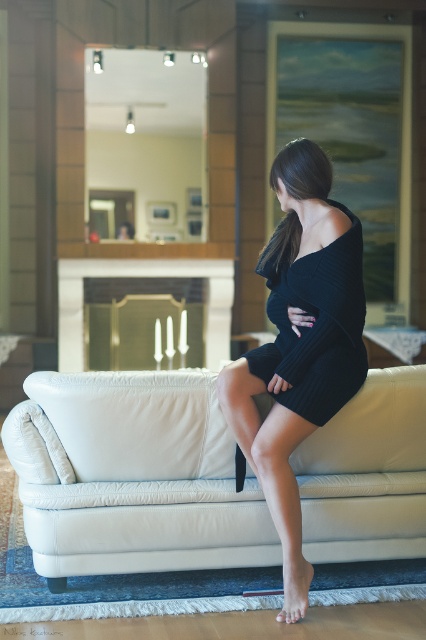
Question: Is white leather couch at center above black knitted dress at center?

Choices:
 (A) yes
 (B) no

Answer: (B)

Question: Which is nearer to the black knitted dress at center?

Choices:
 (A) black ribbed dress at center
 (B) white leather couch at center

Answer: (A)

Question: Which point is farther to the camera?

Choices:
 (A) (317, 349)
 (B) (83, 572)
 (C) (345, 241)

Answer: (B)

Question: Does black knitted dress at center have a greater width compared to black ribbed dress at center?

Choices:
 (A) yes
 (B) no

Answer: (A)

Question: Among these points, which one is farthest from the camera?

Choices:
 (A) (316, 161)
 (B) (302, 291)
 (C) (406, 529)

Answer: (C)

Question: Can you confirm if black knitted dress at center is positioned below black ribbed dress at center?

Choices:
 (A) no
 (B) yes

Answer: (B)